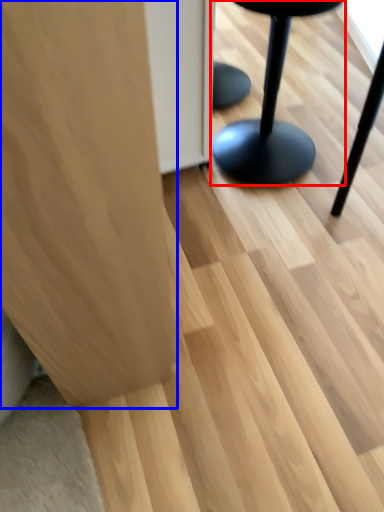
Question: Which of the following is the farthest to the observer, furniture (highlighted by a red box) or furniture (highlighted by a blue box)?

Choices:
 (A) furniture
 (B) furniture

Answer: (A)